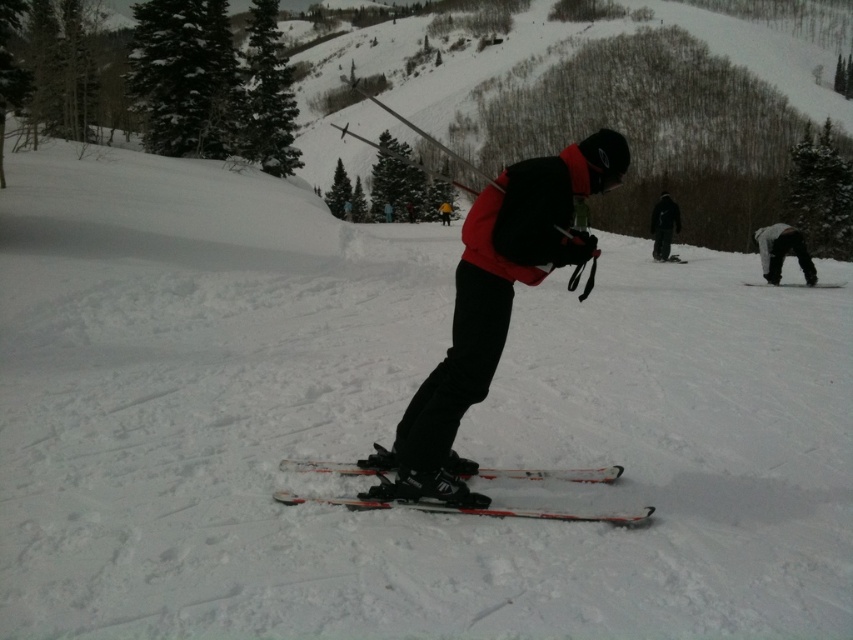
Is dark gray snowboard at center thinner than white matte ski at center?

No.

At what (x,y) coordinates should I click in order to perform the action: click on dark gray snowboard at center. Please return your answer as a coordinate pair (x, y). This screenshot has width=853, height=640. Looking at the image, I should click on (663, 225).

Between gray fabric pants at lower right and white matte ski at center, which one appears on the left side from the viewer's perspective?

Positioned to the left is white matte ski at center.

What are the coordinates of `gray fabric pants at lower right` in the screenshot? It's located at (782, 252).

Where is `gray fabric pants at lower right`? The image size is (853, 640). gray fabric pants at lower right is located at coordinates (782, 252).

Between matte black ski suit at center and gray fabric pants at lower right, which one appears on the left side from the viewer's perspective?

Positioned to the left is matte black ski suit at center.

Does point (431, 413) lie in front of point (775, 253)?

That is True.

Locate an element on the screen. The width and height of the screenshot is (853, 640). matte black ski suit at center is located at coordinates (496, 300).